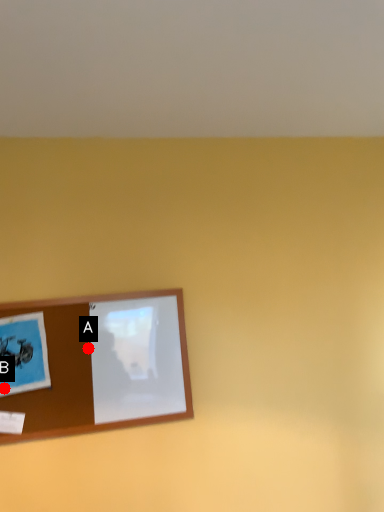
Question: Two points are circled on the image, labeled by A and B beside each circle. Which of the following is the closest to the observer?

Choices:
 (A) A is closer
 (B) B is closer

Answer: (B)